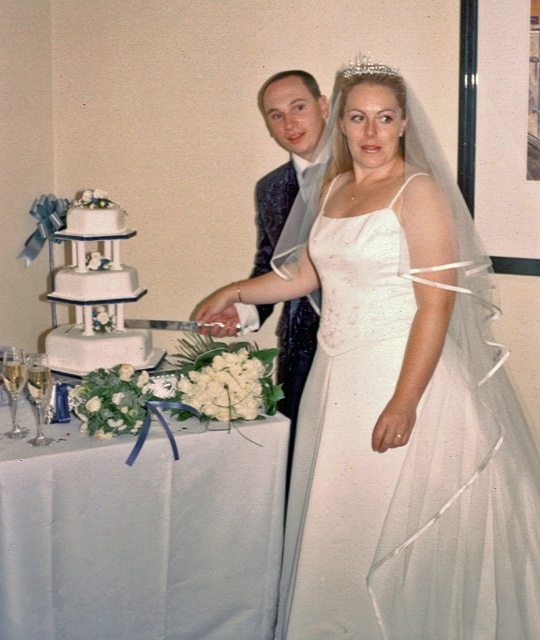
You are a photographer at the wedding and need to position yourself to capture the couple cutting the cake. The white satin tablecloth at center and the white fondant cake at left are both in your view. Which object is positioned to the right side of the other?

The white satin tablecloth at center is to the right of the white fondant cake at left.